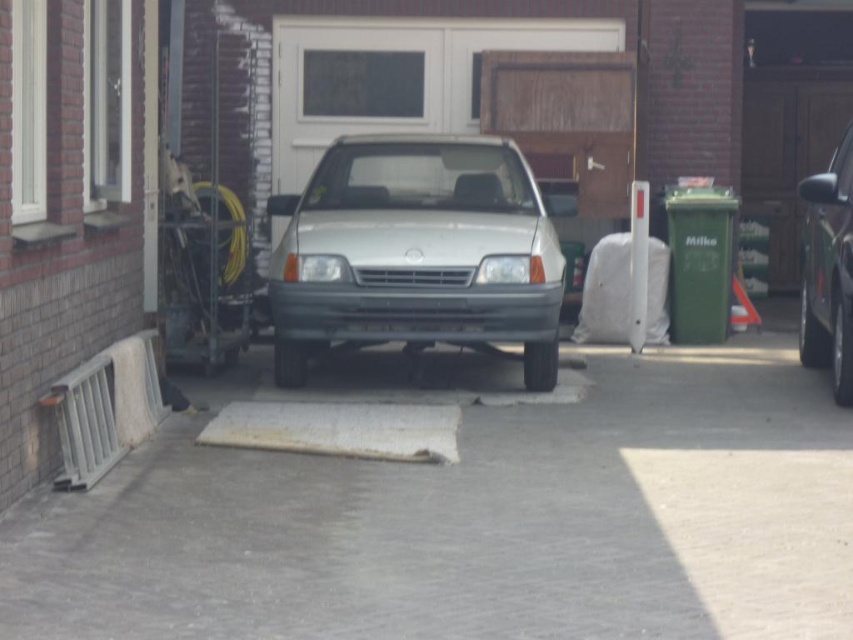
You are a delivery person trying to park your van between the satin silver car at center and the shiny metallic suv at right. Can you fit your van, which is 1.8 meters tall, between them?

The satin silver car at center has a lesser height compared to shiny metallic suv at right, so the minimum height between them would be the height of the satin silver car. If the satin silver car is shorter than 1.8 meters, the van might not fit. However, without exact measurements, it is uncertain. Please check the actual height of the satin silver car before attempting to park.

You are a delivery person trying to park your van between the gray concrete driveway at center and the shiny metallic suv at right. Can you fit your van there if the van is 2 meters wide?

The gray concrete driveway at center is positioned on the left side of the shiny metallic suv at right. Since the distance between them isn

You are standing on the driveway and want to walk towards the house. Which point, point (234,636) or point (527,269), is closer to you as you face the house?

Point (234,636) is closer to the viewer than point (527,269). Therefore, as you face the house, point (234,636) is closer to you.